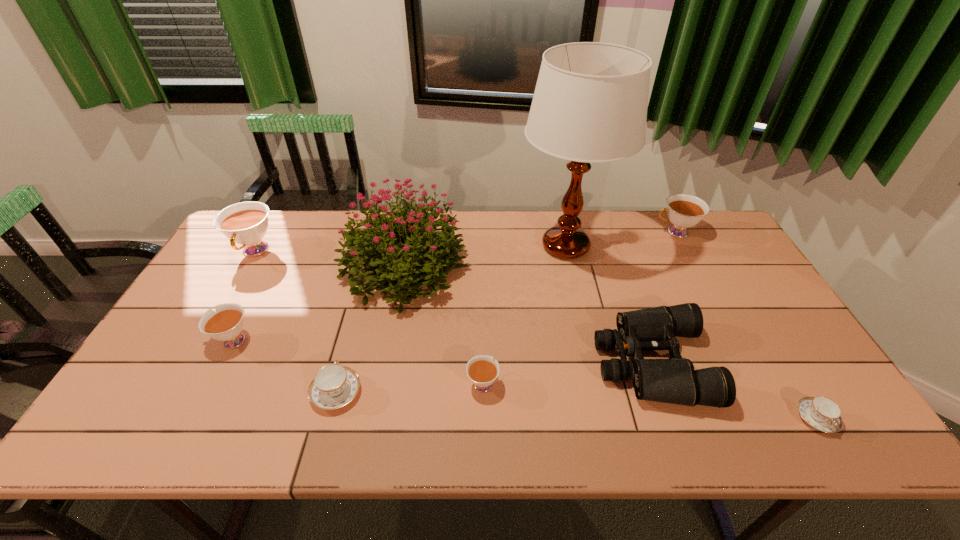
Where is `vacant area between the black binoculars and the fifth object from right to left`? This screenshot has width=960, height=540. vacant area between the black binoculars and the fifth object from right to left is located at coordinates (567, 373).

The width and height of the screenshot is (960, 540). What are the coordinates of `free space that is in between the second tallest teacup and the fourth teacup from right to left` in the screenshot? It's located at (506, 312).

Point out which object is positioned as the fourth nearest to the green bouquet. Please provide its 2D coordinates. Your answer should be formatted as a tuple, i.e. [(x, y)], where the tuple contains the x and y coordinates of a point satisfying the conditions above.

[(334, 386)]

Find the location of a particular element. This screenshot has height=540, width=960. object that is the sixth nearest to the shortest object is located at coordinates (334, 386).

Locate which teacup is the third closest to the fourth shortest teacup. Please provide its 2D coordinates. Your answer should be formatted as a tuple, i.e. [(x, y)], where the tuple contains the x and y coordinates of a point satisfying the conditions above.

[(482, 370)]

Locate an element on the screen. The width and height of the screenshot is (960, 540). teacup that stands as the sixth closest to the second tallest object is located at coordinates (823, 414).

Point out which white teacup is positioned as the fourth nearest to the black binoculars. Please provide its 2D coordinates. Your answer should be formatted as a tuple, i.e. [(x, y)], where the tuple contains the x and y coordinates of a point satisfying the conditions above.

[(245, 223)]

Identify which white teacup is the nearest to the second white teacup from right to left. Please provide its 2D coordinates. Your answer should be formatted as a tuple, i.e. [(x, y)], where the tuple contains the x and y coordinates of a point satisfying the conditions above.

[(226, 324)]

At what (x,y) coordinates should I click in order to perform the action: click on free location that satisfies the following two spatial constraints: 1. on the side of the third smallest white teacup with the handle; 2. on the side of the biggest white teacup with the handle. Please return your answer as a coordinate pair (x, y). The height and width of the screenshot is (540, 960). Looking at the image, I should click on (685, 251).